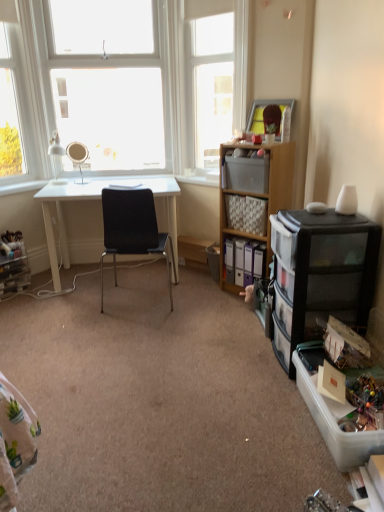
This screenshot has height=512, width=384. Identify the location of free point below white glossy lamp at upper left (from a real-world perspective). (59, 184).